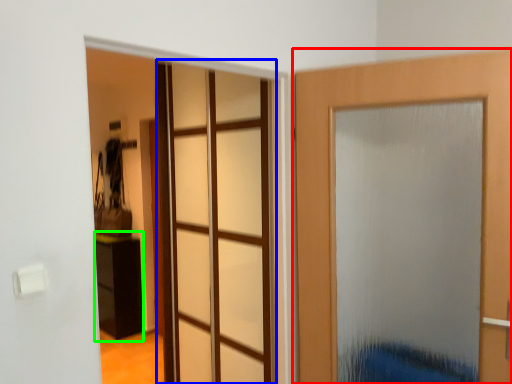
Question: Which object is positioned farthest from door (highlighted by a red box)? Select from glass door (highlighted by a blue box) and furniture (highlighted by a green box).

Choices:
 (A) glass door
 (B) furniture

Answer: (B)